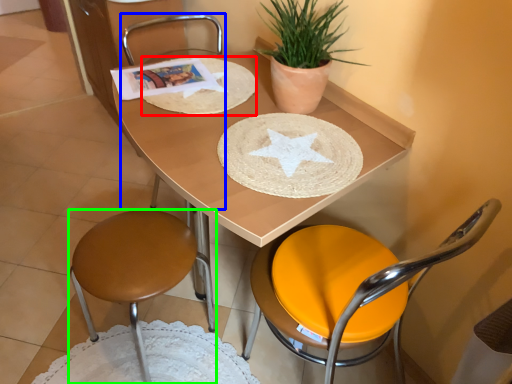
Question: Which is nearer to the paper plate (highlighted by a red box)? chair (highlighted by a blue box) or chair (highlighted by a green box).

Choices:
 (A) chair
 (B) chair

Answer: (B)